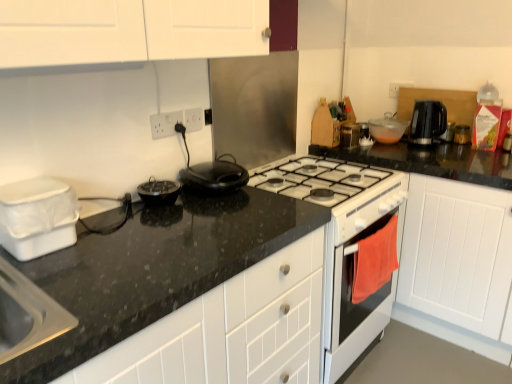
Image resolution: width=512 pixels, height=384 pixels. Find the location of `vacant space in white plastic container at left, placed as the seventh kitchen appliance when sorted from right to left (from a real-world perspective)`. vacant space in white plastic container at left, placed as the seventh kitchen appliance when sorted from right to left (from a real-world perspective) is located at coordinates (47, 254).